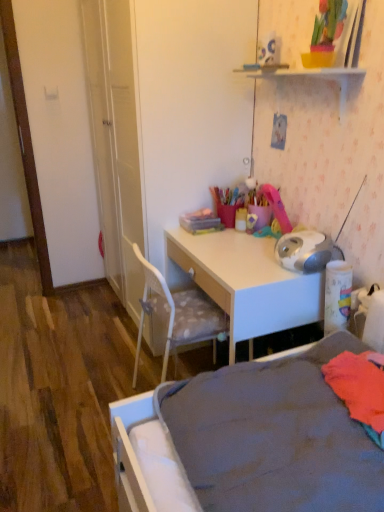
Question: Would you say white glossy desk at center contains white plastic shelf at upper center?

Choices:
 (A) yes
 (B) no

Answer: (B)

Question: Would you say white glossy desk at center is a long distance from white plastic shelf at upper center?

Choices:
 (A) yes
 (B) no

Answer: (B)

Question: Is the depth of white glossy desk at center greater than that of white plastic shelf at upper center?

Choices:
 (A) no
 (B) yes

Answer: (B)

Question: From a real-world perspective, does white glossy desk at center stand above white plastic shelf at upper center?

Choices:
 (A) no
 (B) yes

Answer: (A)

Question: From a real-world perspective, does white glossy desk at center sit lower than white plastic shelf at upper center?

Choices:
 (A) yes
 (B) no

Answer: (A)

Question: From the image's perspective, is white glossy desk at center beneath white plastic shelf at upper center?

Choices:
 (A) yes
 (B) no

Answer: (A)

Question: Can you confirm if gray fabric bed at lower right is taller than white glossy desk at center?

Choices:
 (A) no
 (B) yes

Answer: (A)

Question: Is gray fabric bed at lower right to the left of white glossy desk at center from the viewer's perspective?

Choices:
 (A) yes
 (B) no

Answer: (B)

Question: From a real-world perspective, is gray fabric bed at lower right on white glossy desk at center?

Choices:
 (A) yes
 (B) no

Answer: (A)

Question: Considering the relative sizes of gray fabric bed at lower right and white glossy desk at center in the image provided, is gray fabric bed at lower right bigger than white glossy desk at center?

Choices:
 (A) yes
 (B) no

Answer: (B)

Question: Would you say white glossy desk at center is part of gray fabric bed at lower right's contents?

Choices:
 (A) yes
 (B) no

Answer: (B)

Question: Does gray fabric bed at lower right have a greater width compared to white glossy desk at center?

Choices:
 (A) yes
 (B) no

Answer: (A)

Question: Is gray fabric bed at lower right at the back of white glossy desk at center?

Choices:
 (A) yes
 (B) no

Answer: (B)